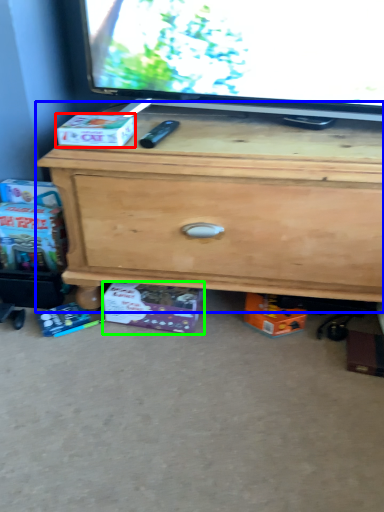
Question: Which object is the closest to the box (highlighted by a red box)? Choose among these: chest of drawers (highlighted by a blue box) or box (highlighted by a green box).

Choices:
 (A) chest of drawers
 (B) box

Answer: (A)